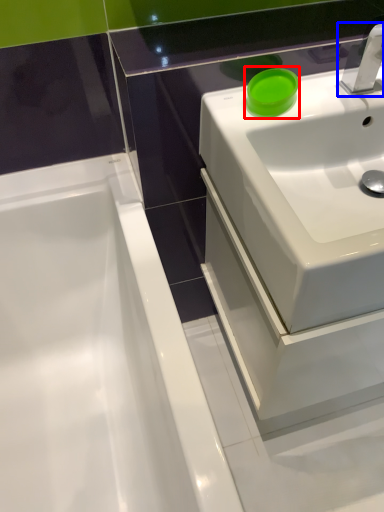
Question: Which of the following is the closest to the observer, teal (highlighted by a red box) or tap (highlighted by a blue box)?

Choices:
 (A) teal
 (B) tap

Answer: (B)